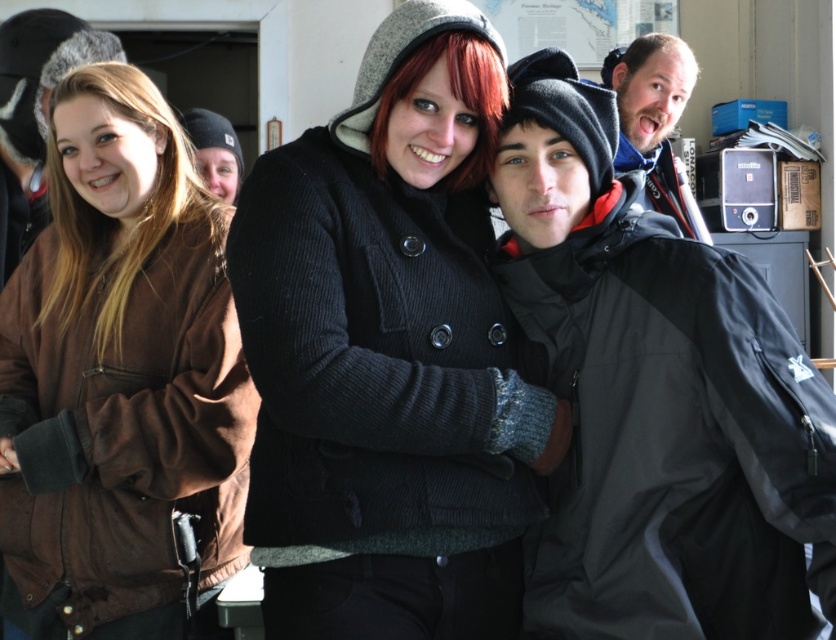
You are taking a photo of the scene. The brown suede jacket at left and the bearded man at upper right are both in the frame. Which object is closer to the bottom edge of the photo?

The brown suede jacket at left is closer to the bottom edge of the photo because it is positioned below the bearded man at upper right.

You are trying to decide which item to take with you for a trip. The matte black jacket at center and the bearded man at upper right are both in your luggage. Which item takes up more space in your luggage?

The matte black jacket at center takes up more space in your luggage because its width is larger than that of the bearded man at upper right.

You are standing at the point marked by the coordinates point (x=589, y=304). You want to move to the door located 10 meters north of your current position. If you walk straight north, will you reach the door before encountering any obstacles?

The point (x=589, y=304) is 4.52 meters away from the viewer. If you walk straight north, you would first reach the door located 10 meters north before encountering any obstacles, since the distance to the door is greater than the distance to the viewer.